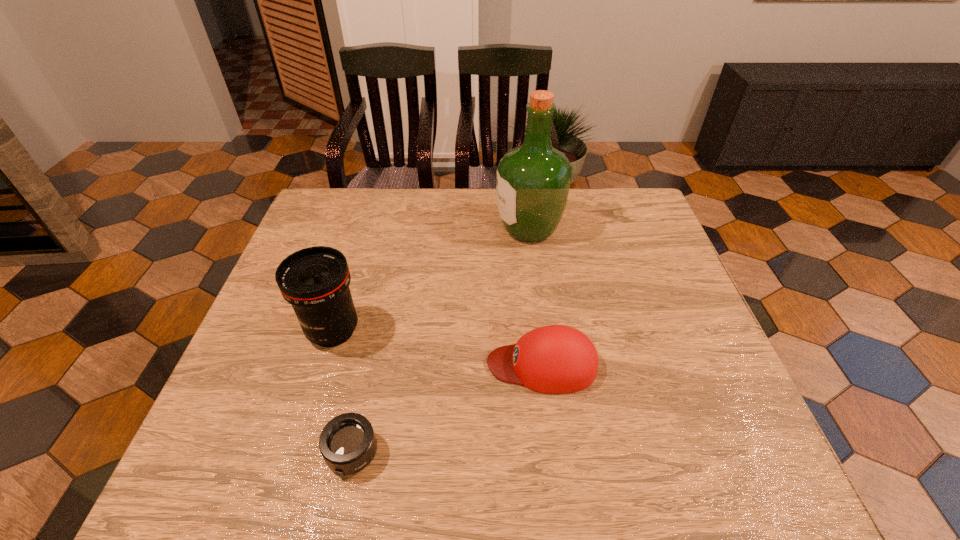
At what (x,y) coordinates should I click in order to perform the action: click on vacant area at the right edge of the desktop. Please return your answer as a coordinate pair (x, y). Image resolution: width=960 pixels, height=540 pixels. Looking at the image, I should click on (666, 276).

This screenshot has height=540, width=960. In the image, there is a desktop. Find the location of `free space at the near left corner`. free space at the near left corner is located at coordinates (230, 477).

Identify the location of vacant space at the far right corner of the desktop. This screenshot has width=960, height=540. (642, 192).

In order to click on unoccupied position between the third shortest object and the baseball cap in this screenshot , I will do `click(438, 348)`.

The width and height of the screenshot is (960, 540). Find the location of `empty space between the second tallest object and the liquor`. empty space between the second tallest object and the liquor is located at coordinates (431, 280).

This screenshot has height=540, width=960. Find the location of `vacant point located between the tallest object and the farther telephoto lens`. vacant point located between the tallest object and the farther telephoto lens is located at coordinates (431, 280).

Find the location of a particular element. vacant area that lies between the third tallest object and the nearest object is located at coordinates (447, 409).

The image size is (960, 540). Identify the location of free space between the second tallest object and the shorter telephoto lens. (343, 392).

The height and width of the screenshot is (540, 960). Find the location of `free space that is in between the farther telephoto lens and the farthest object`. free space that is in between the farther telephoto lens and the farthest object is located at coordinates (431, 280).

In order to click on free space that is in between the baseball cap and the farther telephoto lens in this screenshot , I will do `click(438, 348)`.